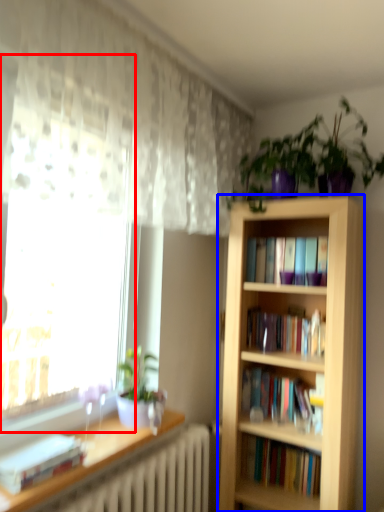
Question: Which object is closer to the camera taking this photo, bay window (highlighted by a red box) or bookcase (highlighted by a blue box)?

Choices:
 (A) bay window
 (B) bookcase

Answer: (A)